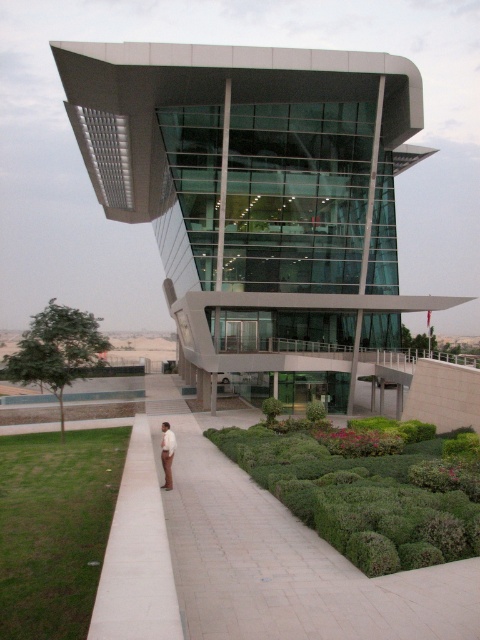
You are standing at the entrance of the glassy modern building at center. If you walk 10 meters straight ahead, will you be closer to the building or farther away?

Since you are starting at the entrance of the glassy modern building at center and walking straight ahead, you will move away from the building, so you will be farther away from the glassy modern building at center after walking 10 meters.

You are standing in front of the glassy modern building at center and the white smooth shirt at center. Which object is positioned higher from the ground?

The glassy modern building at center is located above the white smooth shirt at center, so it is positioned higher from the ground.

You are a delivery person with a cart that can move up to 10 meters per minute. You need to deliver a package to the entrance of the glassy modern building at center. If you start from the green bushy hedge at lower center, how many minutes will it take you to reach the building?

The distance between the glassy modern building at center and the green bushy hedge at lower center is 22.88 meters. Since your cart moves at 10 meters per minute, it will take approximately 2.288 minutes, which rounds to about 2.3 minutes to reach the building.